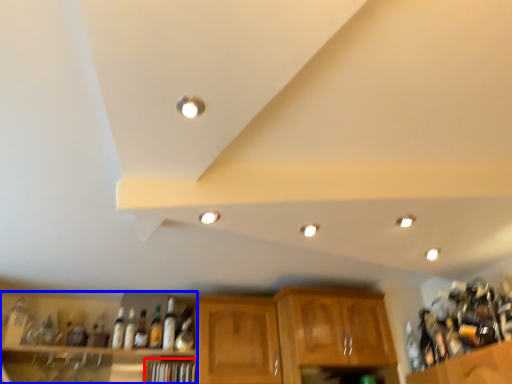
Question: Which of the following is the closest to the observer, shelf (highlighted by a red box) or shelf (highlighted by a blue box)?

Choices:
 (A) shelf
 (B) shelf

Answer: (B)